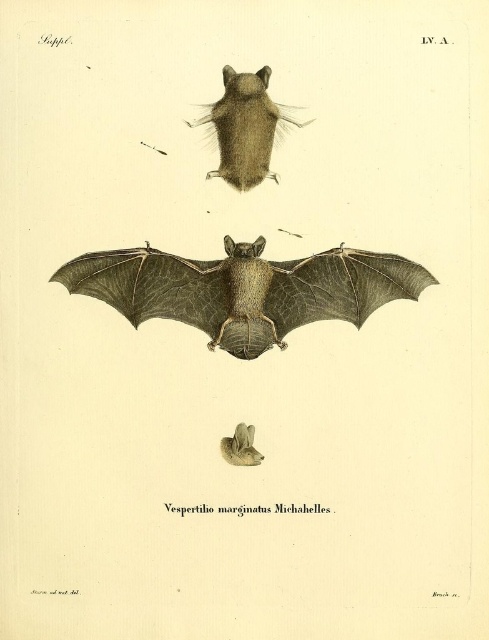
Based on the photo, who is shorter, furry brown bat at upper center or gray fur bat at center?

With less height is gray fur bat at center.

Is point (225, 138) behind point (248, 456)?

Yes.

Identify the location of furry brown bat at upper center. The image size is (489, 640). (244, 128).

Where is `furry brown bat at upper center`? The width and height of the screenshot is (489, 640). furry brown bat at upper center is located at coordinates (244, 128).

How far apart are brown leather bat at center and furry brown bat at upper center?

brown leather bat at center is 9.38 inches away from furry brown bat at upper center.

Locate an element on the screen. The image size is (489, 640). brown leather bat at center is located at coordinates (244, 289).

You are a GUI agent. You are given a task and a screenshot of the screen. Output one action in this format:
    pyautogui.click(x=<x>, y=<y>)
    Task: Click on the brown leather bat at center
    
    Given the screenshot: What is the action you would take?
    pyautogui.click(x=244, y=289)

The height and width of the screenshot is (640, 489). What are the coordinates of `brown leather bat at center` in the screenshot? It's located at (244, 289).

Who is positioned more to the left, brown leather bat at center or gray fur bat at center?

From the viewer's perspective, brown leather bat at center appears more on the left side.

Measure the distance between brown leather bat at center and camera.

A distance of 1.59 meters exists between brown leather bat at center and camera.

You are a GUI agent. You are given a task and a screenshot of the screen. Output one action in this format:
    pyautogui.click(x=<x>, y=<y>)
    Task: Click on the brown leather bat at center
    This screenshot has height=640, width=489.
    Given the screenshot: What is the action you would take?
    pyautogui.click(x=244, y=289)